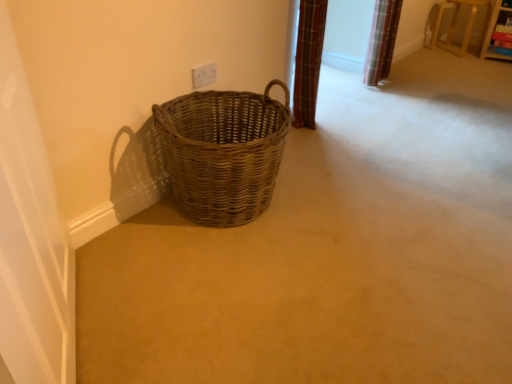
Question: From the image's perspective, does white glossy screen door at left appear higher than woven brown basket at lower left?

Choices:
 (A) yes
 (B) no

Answer: (B)

Question: Is white glossy screen door at left turned away from woven brown basket at lower left?

Choices:
 (A) no
 (B) yes

Answer: (A)

Question: Could woven brown basket at lower left be considered to be inside white glossy screen door at left?

Choices:
 (A) yes
 (B) no

Answer: (B)

Question: Can you confirm if white glossy screen door at left is bigger than woven brown basket at lower left?

Choices:
 (A) yes
 (B) no

Answer: (B)

Question: Can you confirm if white glossy screen door at left is positioned to the right of woven brown basket at lower left?

Choices:
 (A) no
 (B) yes

Answer: (A)

Question: Does white glossy screen door at left have a lesser height compared to woven brown basket at lower left?

Choices:
 (A) yes
 (B) no

Answer: (B)

Question: From a real-world perspective, is white glossy screen door at left physically above white plastic electric outlet at upper center?

Choices:
 (A) no
 (B) yes

Answer: (B)

Question: Is white glossy screen door at left at the left side of white plastic electric outlet at upper center?

Choices:
 (A) yes
 (B) no

Answer: (A)

Question: Is white glossy screen door at left outside of white plastic electric outlet at upper center?

Choices:
 (A) yes
 (B) no

Answer: (A)

Question: Does white glossy screen door at left touch white plastic electric outlet at upper center?

Choices:
 (A) yes
 (B) no

Answer: (B)

Question: Considering the relative sizes of white glossy screen door at left and white plastic electric outlet at upper center in the image provided, is white glossy screen door at left shorter than white plastic electric outlet at upper center?

Choices:
 (A) no
 (B) yes

Answer: (A)

Question: Is white glossy screen door at left not close to white plastic electric outlet at upper center?

Choices:
 (A) yes
 (B) no

Answer: (A)

Question: From a real-world perspective, does woven brown basket at lower left sit lower than white plastic electric outlet at upper center?

Choices:
 (A) no
 (B) yes

Answer: (B)